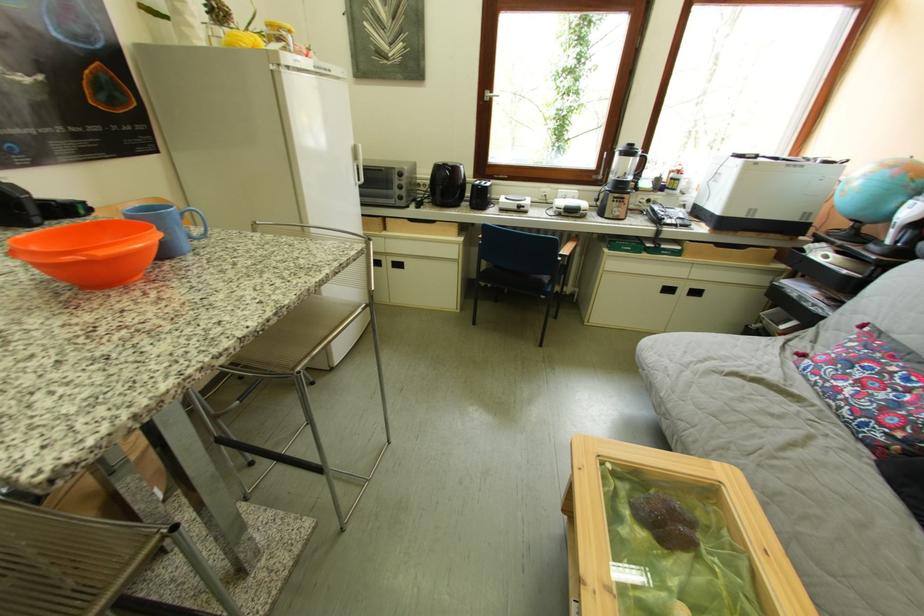
Where would you lift the telephone handset? Please return your answer as a coordinate pair (x, y).

(446, 184)